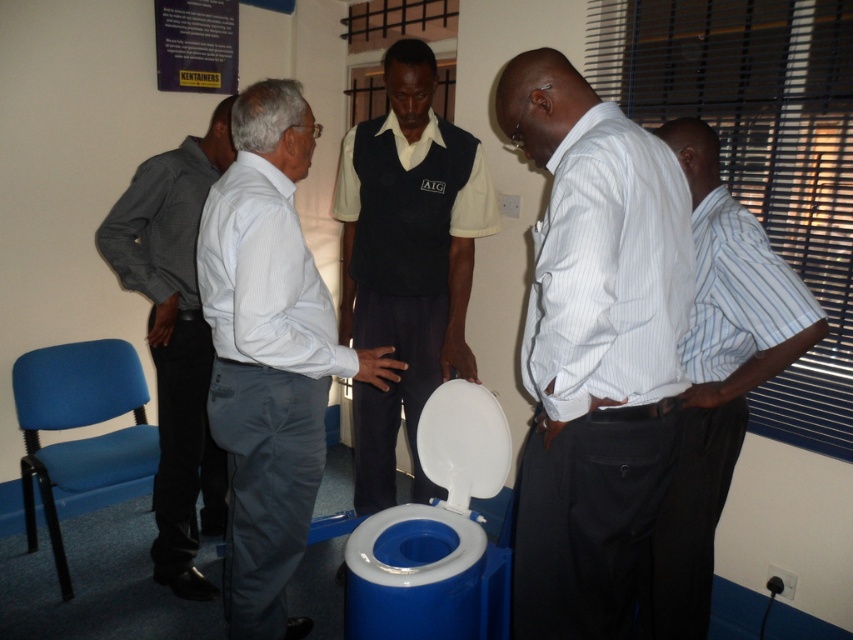
Question: Is white striped shirt at center bigger than white pinstripe shirt at center?

Choices:
 (A) no
 (B) yes

Answer: (A)

Question: Which point is farther to the camera?

Choices:
 (A) dark gray shirt at left
 (B) blue plastic toilet bowl at center

Answer: (A)

Question: Does white pinstripe shirt at center have a lesser width compared to white plastic toilet lid at center?

Choices:
 (A) no
 (B) yes

Answer: (A)

Question: Among these points, which one is nearest to the camera?

Choices:
 (A) (305, 272)
 (B) (471, 436)
 (C) (378, 445)

Answer: (A)

Question: Where is white pinstripe shirt at center located in relation to dark gray shirt at left in the image?

Choices:
 (A) above
 (B) below

Answer: (B)

Question: Estimate the real-world distances between objects in this image. Which object is closer to the white striped shirt at center?

Choices:
 (A) white striped shirt at right
 (B) white pinstripe shirt at center
 (C) dark blue vest at center

Answer: (A)